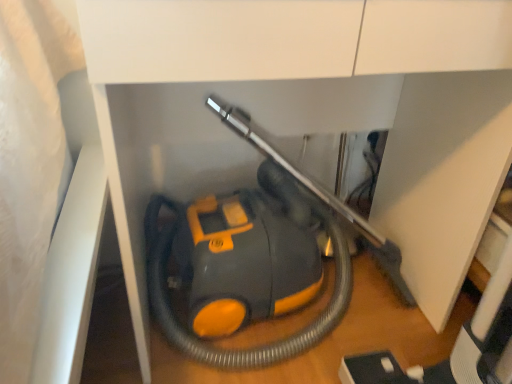
Question: Which direction should I rotate to look at yellow-grey plastic vacuum cleaner at center?

Choices:
 (A) left
 (B) right

Answer: (B)